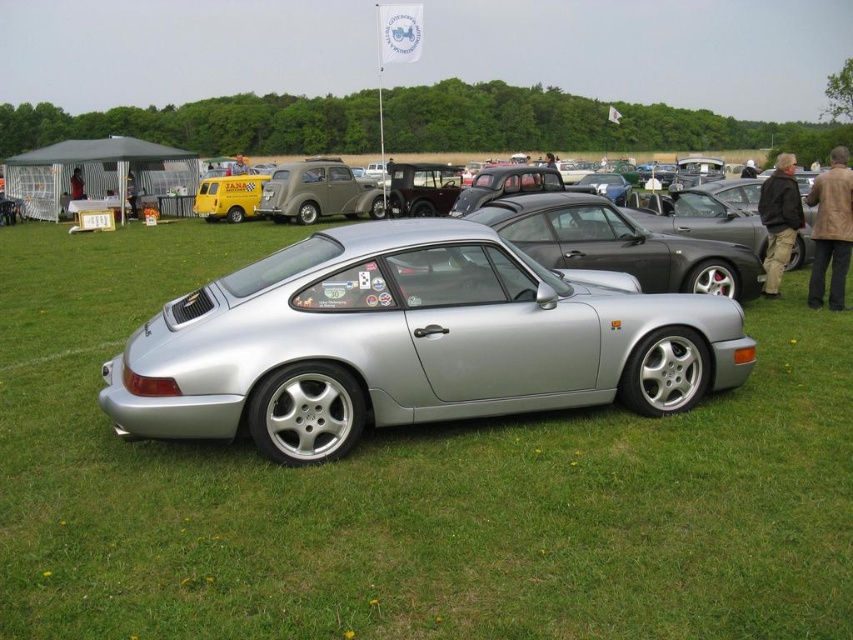
Question: Which of the following is the closest to the observer?

Choices:
 (A) silver metallic car at center
 (B) matte gray sedan at center
 (C) green grass at center

Answer: (C)

Question: Is green grass at center to the left of silver metallic car at center from the viewer's perspective?

Choices:
 (A) yes
 (B) no

Answer: (A)

Question: Which point is farther to the camera?

Choices:
 (A) (556, 323)
 (B) (302, 216)
 (C) (21, 256)

Answer: (B)

Question: Which object appears closest to the camera in this image?

Choices:
 (A) green grass at center
 (B) matte gray sedan at center
 (C) silver metallic car at center

Answer: (A)

Question: Is green grass at center smaller than silver metallic car at center?

Choices:
 (A) yes
 (B) no

Answer: (B)

Question: Is silver metallic car at center smaller than matte gray sedan at center?

Choices:
 (A) no
 (B) yes

Answer: (B)